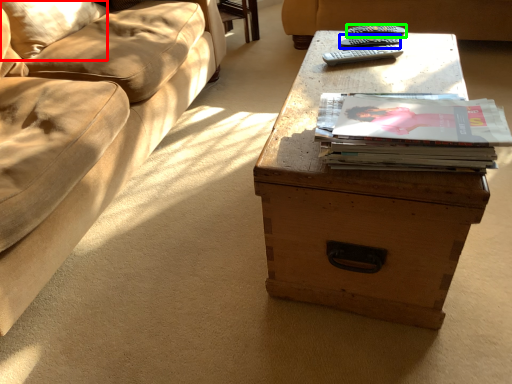
Question: Which object is positioned closest to pillow (highlighted by a red box)? Select from remote (highlighted by a blue box) and remote (highlighted by a green box).

Choices:
 (A) remote
 (B) remote

Answer: (A)